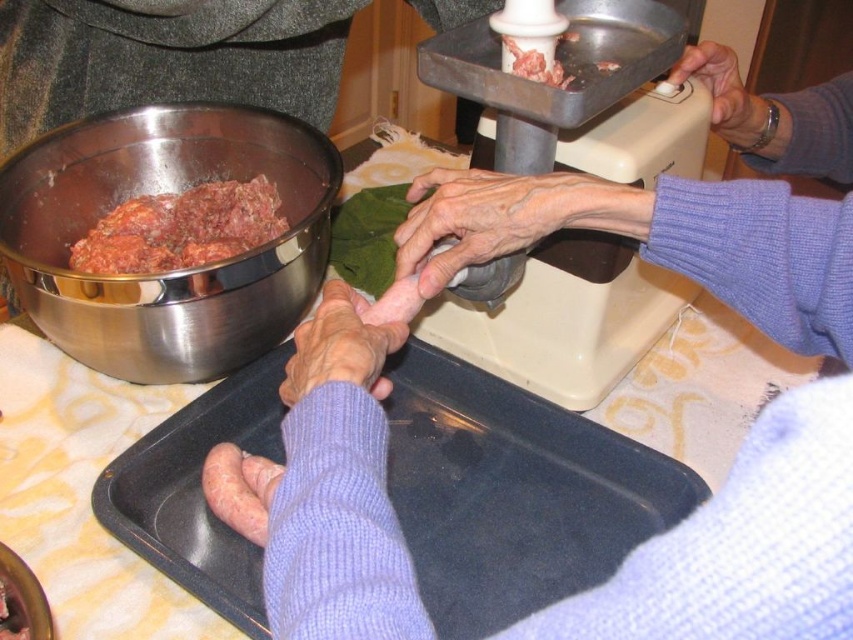
Question: Which object appears farthest from the camera in this image?

Choices:
 (A) smooth beige hand at upper right
 (B) purple knitted hand at center

Answer: (A)

Question: Does black plastic tray at lower center appear on the right side of pinkish smooth sausage at lower left?

Choices:
 (A) yes
 (B) no

Answer: (A)

Question: Which of the following is the closest to the observer?

Choices:
 (A) pinkish smooth sausage at lower left
 (B) metallic plastic scale at upper center
 (C) purple ribbed sweater at center

Answer: (C)

Question: Which point appears farthest from the camera in this image?

Choices:
 (A) (26, 285)
 (B) (717, 129)
 (C) (465, 170)
 (D) (322, 307)

Answer: (B)

Question: Where is metallic plastic scale at upper center located in relation to shiny metallic bowl at left in the image?

Choices:
 (A) below
 (B) above

Answer: (B)

Question: Can you confirm if purple ribbed sweater at center is smaller than dark red textured meat at left?

Choices:
 (A) no
 (B) yes

Answer: (A)